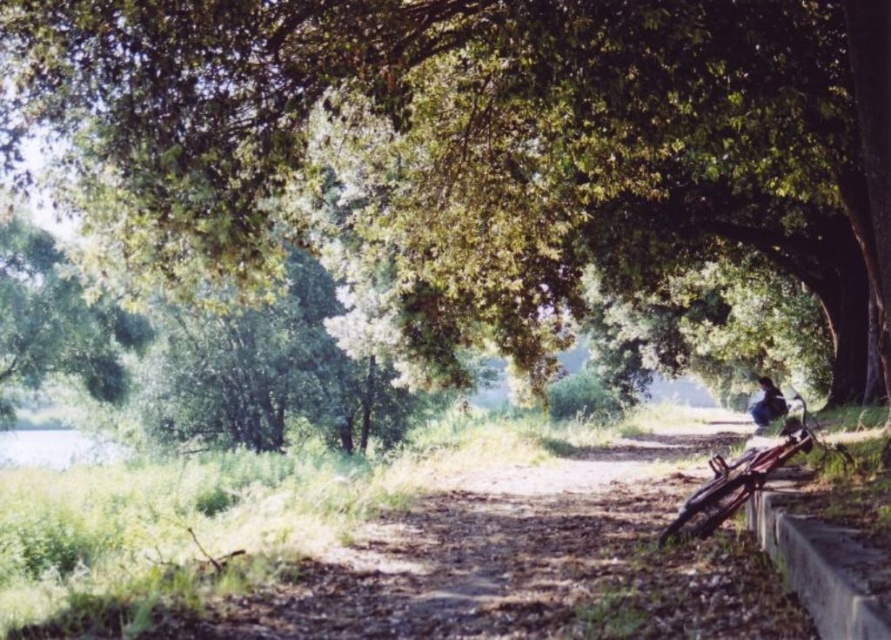
You are planning to walk along the dirt path in the scene. You need to know which object, the green leafy tree at center or the dark blue fabric at lower right, is wider so you can plan your route. Which one is wider?

The green leafy tree at center is wider than the dark blue fabric at lower right.

You are standing at the point marked as point (484,145). What object is exactly at your current location?

The green leafy tree at center is located at point (484,145).

You are standing on the dirt path in the scene. You want to walk towards the green leafy tree at center and the dark blue fabric at lower right. Which object will you reach first?

You will reach the green leafy tree at center first because it is closer to the viewer than the dark blue fabric at lower right.